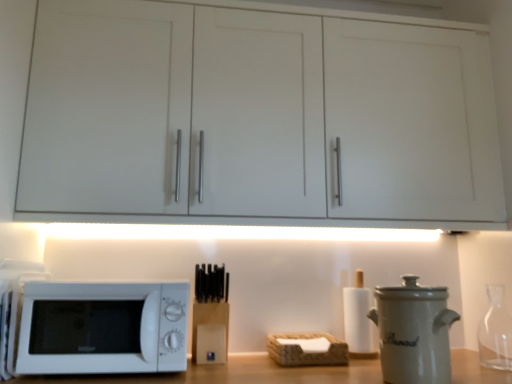
Question: Is white ceramic bread bin at right wider than brown woven basket at center?

Choices:
 (A) no
 (B) yes

Answer: (A)

Question: Is white ceramic bread bin at right outside brown woven basket at center?

Choices:
 (A) yes
 (B) no

Answer: (A)

Question: Is white ceramic bread bin at right further to the viewer compared to brown woven basket at center?

Choices:
 (A) no
 (B) yes

Answer: (A)

Question: Could you tell me if white ceramic bread bin at right is turned towards brown woven basket at center?

Choices:
 (A) no
 (B) yes

Answer: (A)

Question: Is white ceramic bread bin at right taller than brown woven basket at center?

Choices:
 (A) yes
 (B) no

Answer: (A)

Question: Can you confirm if white ceramic bread bin at right is positioned to the right of brown woven basket at center?

Choices:
 (A) no
 (B) yes

Answer: (B)

Question: Could you tell me if transparent glass bottle at right, placed as the 1th bottle when sorted from front to back, is turned towards white ceramic bread bin at right?

Choices:
 (A) no
 (B) yes

Answer: (B)

Question: Considering the relative positions of transparent glass bottle at right, acting as the 1th bottle starting from the right, and white ceramic bread bin at right in the image provided, is transparent glass bottle at right, acting as the 1th bottle starting from the right, to the right of white ceramic bread bin at right from the viewer's perspective?

Choices:
 (A) yes
 (B) no

Answer: (A)

Question: Is transparent glass bottle at right, placed as the 1th bottle when sorted from front to back, positioned with its back to white ceramic bread bin at right?

Choices:
 (A) yes
 (B) no

Answer: (B)

Question: Is transparent glass bottle at right, which ranks as the 2th bottle in back-to-front order, to the left of white ceramic bread bin at right from the viewer's perspective?

Choices:
 (A) no
 (B) yes

Answer: (A)

Question: From a real-world perspective, is transparent glass bottle at right, which ranks as the 2th bottle in back-to-front order, under white ceramic bread bin at right?

Choices:
 (A) no
 (B) yes

Answer: (A)

Question: Is transparent glass bottle at right, placed as the 1th bottle when sorted from front to back, positioned behind white ceramic bread bin at right?

Choices:
 (A) yes
 (B) no

Answer: (A)

Question: Is white ceramic bread bin at right a part of brown woven basket at center?

Choices:
 (A) yes
 (B) no

Answer: (B)